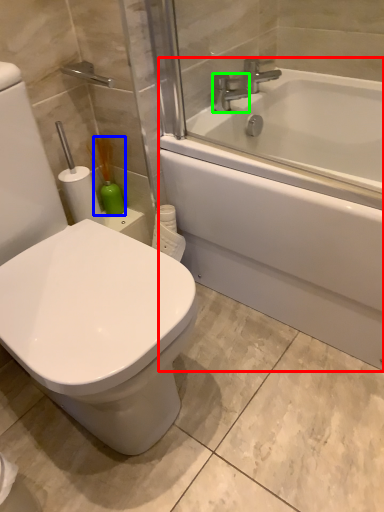
Question: Which object is the farthest from bathtub (highlighted by a red box)? Choose among these: soap dispenser (highlighted by a blue box) or faucet (highlighted by a green box).

Choices:
 (A) soap dispenser
 (B) faucet

Answer: (A)